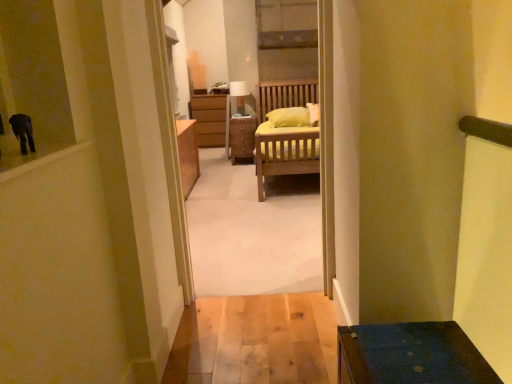
The height and width of the screenshot is (384, 512). What do you see at coordinates (239, 95) in the screenshot? I see `matte white lamp at center` at bounding box center [239, 95].

This screenshot has width=512, height=384. I want to click on wooden bed at center, so click(x=224, y=47).

The image size is (512, 384). Describe the element at coordinates (242, 137) in the screenshot. I see `wooden nightstand at center` at that location.

The image size is (512, 384). What are the coordinates of `matte white lamp at center` in the screenshot? It's located at (239, 95).

Based on the photo, is wooden bed at center wider than matte white lamp at center?

No, wooden bed at center is not wider than matte white lamp at center.

Considering their positions, is wooden bed at center located in front of or behind matte white lamp at center?

Visually, wooden bed at center is located in front of matte white lamp at center.

Considering the sizes of objects wooden bed at center and matte white lamp at center in the image provided, who is bigger, wooden bed at center or matte white lamp at center?

wooden bed at center is bigger.

Which of these two, wooden nightstand at center or wooden bed at center, stands taller?

wooden bed at center.

Which is further, (x=251, y=125) or (x=245, y=40)?

Point (x=251, y=125)

Is wooden nightstand at center facing away from wooden bed at center?

No, wooden nightstand at center's orientation is not away from wooden bed at center.

Find the location of a particular element. Image resolution: width=512 pixels, height=384 pixels. corridor that appears below the wooden nightstand at center (from the image's perspective) is located at coordinates (224, 47).

Measure the distance from matte white lamp at center to wooden bed at center.

21.80 inches.

Considering the sizes of objects matte white lamp at center and wooden bed at center in the image provided, who is smaller, matte white lamp at center or wooden bed at center?

Smaller between the two is matte white lamp at center.

Considering the sizes of objects matte white lamp at center and wooden bed at center in the image provided, who is thinner, matte white lamp at center or wooden bed at center?

Thinner between the two is wooden bed at center.

Which is behind, point (243, 115) or point (216, 137)?

Positioned behind is point (216, 137).

At what (x,y) coordinates should I click in order to perform the action: click on lamp behind the wooden nightstand at center. Please return your answer as a coordinate pair (x, y). Looking at the image, I should click on [239, 95].

In terms of width, does matte white lamp at center look wider or thinner when compared to wooden nightstand at center?

Considering their sizes, matte white lamp at center looks slimmer than wooden nightstand at center.

Between matte white lamp at center and wooden nightstand at center, which one is positioned behind?

matte white lamp at center is behind.

How much distance is there between wooden nightstand at center and matte white lamp at center?

wooden nightstand at center and matte white lamp at center are 14.32 inches apart.

From the image's perspective, which is below, wooden nightstand at center or matte white lamp at center?

wooden nightstand at center is shown below in the image.

Is matte white lamp at center surrounded by wooden nightstand at center?

Definitely not — matte white lamp at center is not inside wooden nightstand at center.

The image size is (512, 384). I want to click on table that is under the matte white lamp at center (from a real-world perspective), so click(242, 137).

Could you tell me if wooden bed at center is facing wooden nightstand at center?

Yes, wooden bed at center is oriented towards wooden nightstand at center.

Which is farther, (187, 7) or (241, 139)?

Positioned behind is point (241, 139).

Which of these two, wooden bed at center or wooden nightstand at center, stands shorter?

Standing shorter between the two is wooden nightstand at center.

Which object is thinner, wooden bed at center or wooden nightstand at center?

wooden bed at center is thinner.

What are the coordinates of `corridor below the matte white lamp at center (from the image's perspective)` in the screenshot? It's located at (224, 47).

There is a wooden nightstand at center. Where is `corridor above it (from a real-world perspective)`? This screenshot has width=512, height=384. corridor above it (from a real-world perspective) is located at coordinates (224, 47).

Which object lies nearer to the anchor point matte white lamp at center, wooden nightstand at center or wooden bed at center?

Based on the image, wooden nightstand at center appears to be nearer to matte white lamp at center.

From the image, which object appears to be nearer to matte white lamp at center, wooden bed at center or wooden nightstand at center?

wooden nightstand at center.

Estimate the real-world distances between objects in this image. Which object is closer to wooden bed at center, wooden nightstand at center or matte white lamp at center?

matte white lamp at center.

From the image, which object appears to be nearer to wooden nightstand at center, matte white lamp at center or wooden bed at center?

matte white lamp at center is closer to wooden nightstand at center.

Which object lies nearer to the anchor point wooden bed at center, matte white lamp at center or wooden nightstand at center?

matte white lamp at center is closer to wooden bed at center.

Estimate the real-world distances between objects in this image. Which object is further from wooden nightstand at center, wooden bed at center or matte white lamp at center?

Among the two, wooden bed at center is located further to wooden nightstand at center.

At what (x,y) coordinates should I click in order to perform the action: click on table between wooden bed at center and matte white lamp at center in the front-back direction. Please return your answer as a coordinate pair (x, y). Looking at the image, I should click on (242, 137).